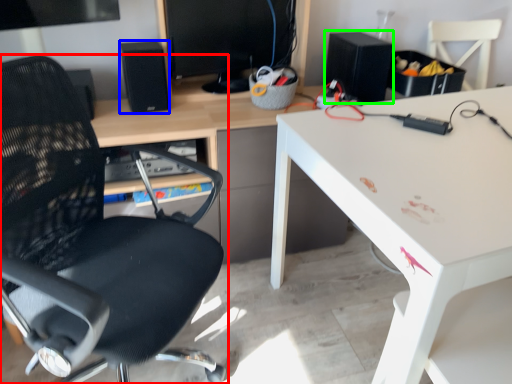
Question: Considering the real-world distances, which object is closest to chair (highlighted by a red box)? speaker (highlighted by a blue box) or speaker (highlighted by a green box).

Choices:
 (A) speaker
 (B) speaker

Answer: (A)